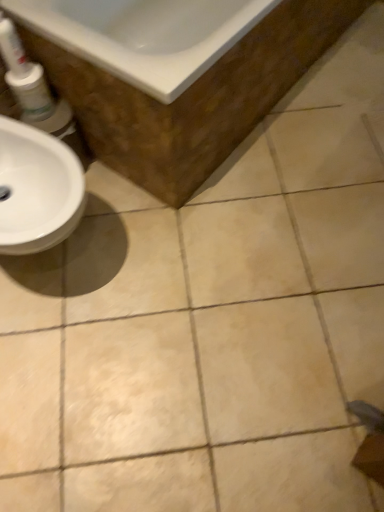
I want to click on white glossy mouthwash at left, so click(31, 92).

Where is `white glossy bathtub at upper left`? The image size is (384, 512). white glossy bathtub at upper left is located at coordinates (194, 97).

Where is `white glossy mouthwash at left`? white glossy mouthwash at left is located at coordinates (31, 92).

Between white glossy tube at upper left and white glossy bathtub at upper left, which one has less height?

Standing shorter between the two is white glossy tube at upper left.

Does white glossy tube at upper left turn towards white glossy bathtub at upper left?

No, white glossy tube at upper left is not oriented towards white glossy bathtub at upper left.

Can you confirm if white glossy tube at upper left is thinner than white glossy bathtub at upper left?

Yes, white glossy tube at upper left is thinner than white glossy bathtub at upper left.

Identify the location of bath that appears in front of the white glossy mouthwash at left. The height and width of the screenshot is (512, 384). (194, 97).

Based on the photo, in terms of height, does white glossy mouthwash at left look taller or shorter compared to white glossy bathtub at upper left?

In the image, white glossy mouthwash at left appears to be shorter than white glossy bathtub at upper left.

Is white glossy mouthwash at left aimed at white glossy bathtub at upper left?

No, white glossy mouthwash at left is not turned towards white glossy bathtub at upper left.

Is white glossy bathtub at upper left a part of white glossy mouthwash at left?

No.

In the image, is white glossy bathtub at upper left positioned in front of or behind white glossy mouthwash at left?

In the image, white glossy bathtub at upper left appears in front of white glossy mouthwash at left.

Does white glossy bathtub at upper left contain white glossy mouthwash at left?

No.

Considering the sizes of objects white glossy bathtub at upper left and white glossy mouthwash at left in the image provided, who is bigger, white glossy bathtub at upper left or white glossy mouthwash at left?

With larger size is white glossy bathtub at upper left.

From a real-world perspective, which is physically above, white glossy bathtub at upper left or white glossy mouthwash at left?

white glossy mouthwash at left.

Between white glossy tube at upper left and white glossy mouthwash at left, which one has larger size?

With larger size is white glossy mouthwash at left.

Which is correct: white glossy tube at upper left is inside white glossy mouthwash at left, or outside of it?

white glossy tube at upper left lies outside white glossy mouthwash at left.

Is white glossy tube at upper left thinner than white glossy mouthwash at left?

Yes.

How distant is white glossy bathtub at upper left from white glossy tube at upper left?

white glossy bathtub at upper left is 20.82 inches away from white glossy tube at upper left.

From the picture: From a real-world perspective, is white glossy bathtub at upper left on top of white glossy tube at upper left?

No, from a real-world perspective, white glossy bathtub at upper left is not over white glossy tube at upper left

Which of these two, white glossy bathtub at upper left or white glossy tube at upper left, is thinner?

With smaller width is white glossy tube at upper left.

Which is correct: white glossy bathtub at upper left is inside white glossy tube at upper left, or outside of it?

white glossy bathtub at upper left exists outside the volume of white glossy tube at upper left.

From a real-world perspective, between white glossy mouthwash at left and white glossy tube at upper left, who is vertically higher?

white glossy tube at upper left, from a real-world perspective.

Can you tell me how much white glossy mouthwash at left and white glossy tube at upper left differ in facing direction?

2.48 degrees.

Find the location of `cleaning product above the white glossy mouthwash at left (from a real-world perspective)`. cleaning product above the white glossy mouthwash at left (from a real-world perspective) is located at coordinates (12, 48).

The width and height of the screenshot is (384, 512). In the image, there is a white glossy tube at upper left. In order to click on bath above it (from the image's perspective) in this screenshot , I will do `click(194, 97)`.

You are a GUI agent. You are given a task and a screenshot of the screen. Output one action in this format:
    pyautogui.click(x=<x>, y=<y>)
    Task: Click on the mouthwash on the left of white glossy bathtub at upper left
    
    Given the screenshot: What is the action you would take?
    pyautogui.click(x=31, y=92)

Which object lies further to the anchor point white glossy bathtub at upper left, white glossy mouthwash at left or white glossy tube at upper left?

Among the two, white glossy tube at upper left is located further to white glossy bathtub at upper left.

Based on their spatial positions, is white glossy bathtub at upper left or white glossy mouthwash at left closer to white glossy tube at upper left?

white glossy mouthwash at left is positioned closer to the anchor white glossy tube at upper left.

Considering their positions, is white glossy tube at upper left positioned closer to white glossy bathtub at upper left than white glossy mouthwash at left?

The object closer to white glossy bathtub at upper left is white glossy mouthwash at left.

When comparing their distances from white glossy tube at upper left, does white glossy mouthwash at left or white glossy bathtub at upper left seem further?

white glossy bathtub at upper left is positioned further to the anchor white glossy tube at upper left.

In the scene shown: Estimate the real-world distances between objects in this image. Which object is further from white glossy mouthwash at left, white glossy tube at upper left or white glossy bathtub at upper left?

white glossy bathtub at upper left is further to white glossy mouthwash at left.

From the image, which object appears to be nearer to white glossy mouthwash at left, white glossy bathtub at upper left or white glossy tube at upper left?

Among the two, white glossy tube at upper left is located nearer to white glossy mouthwash at left.

Where is `mouthwash between white glossy tube at upper left and white glossy bathtub at upper left from left to right`? The width and height of the screenshot is (384, 512). mouthwash between white glossy tube at upper left and white glossy bathtub at upper left from left to right is located at coordinates (31, 92).